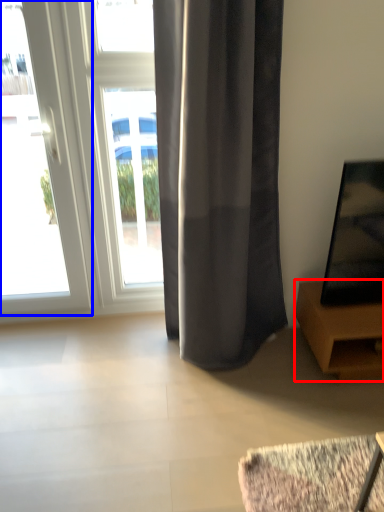
Question: Among these objects, which one is nearest to the camera, furniture (highlighted by a red box) or door (highlighted by a blue box)?

Choices:
 (A) furniture
 (B) door

Answer: (B)